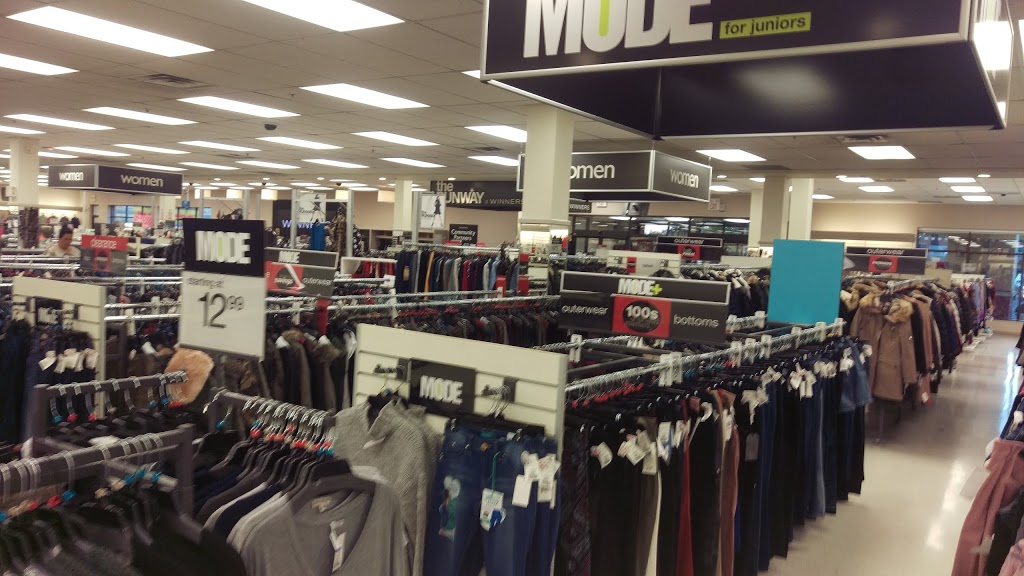
Identify the location of right wall of store. Image resolution: width=1024 pixels, height=576 pixels. (49, 197).